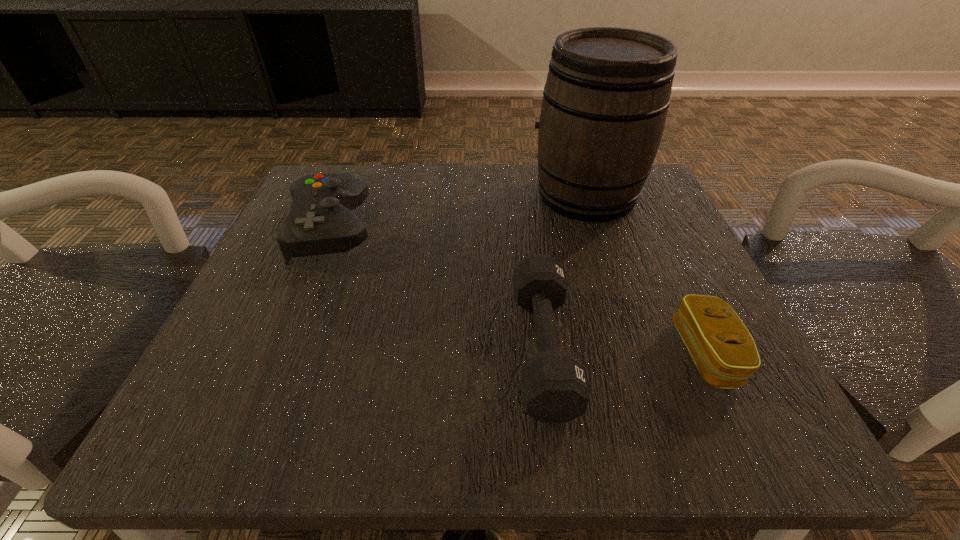
Find the location of a particular element. vacant space at the far edge of the desktop is located at coordinates (477, 207).

In the image, there is a desktop. Where is `vacant area at the near edge`? The width and height of the screenshot is (960, 540). vacant area at the near edge is located at coordinates (461, 427).

Image resolution: width=960 pixels, height=540 pixels. In the image, there is a desktop. What are the coordinates of `free region at the left edge` in the screenshot? It's located at (332, 338).

You are a GUI agent. You are given a task and a screenshot of the screen. Output one action in this format:
    pyautogui.click(x=<x>, y=<y>)
    Task: Click on the vacant area at the far left corner
    
    Given the screenshot: What is the action you would take?
    pyautogui.click(x=337, y=166)

Image resolution: width=960 pixels, height=540 pixels. Find the location of `vacant area at the far right corner`. vacant area at the far right corner is located at coordinates (625, 215).

Identify the location of free space between the wine bucket and the leftmost object. (458, 212).

Locate an element on the screen. This screenshot has height=540, width=960. vacant point located between the dumbbell and the control is located at coordinates (437, 289).

Where is `free space between the clutch bag and the tallest object`? free space between the clutch bag and the tallest object is located at coordinates (646, 274).

The width and height of the screenshot is (960, 540). Identify the location of free spot between the control and the tallest object. (458, 212).

Locate an element on the screen. The image size is (960, 540). empty location between the dumbbell and the control is located at coordinates (437, 289).